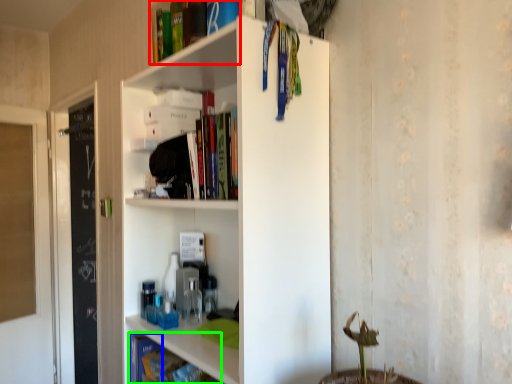
Question: Which object is positioned closest to book (highlighted by a red box)? Select from book (highlighted by a blue box) and book (highlighted by a green box).

Choices:
 (A) book
 (B) book

Answer: (B)